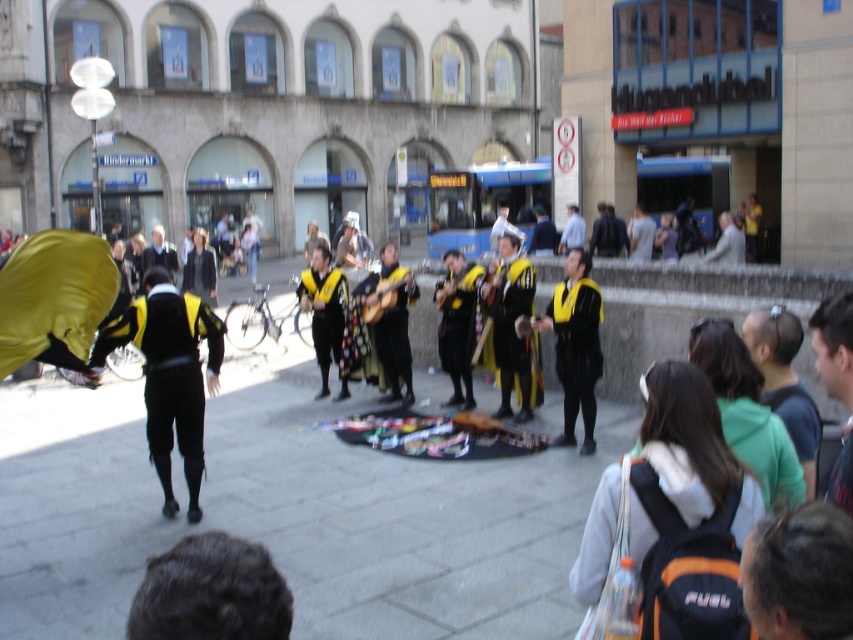
Question: Which point appears farthest from the camera in this image?

Choices:
 (A) (738, 252)
 (B) (167, 410)
 (C) (148, 262)
 (D) (792, 424)

Answer: (A)

Question: Is dark blue hoodie at lower right positioned in front of black velvet jacket at center?

Choices:
 (A) yes
 (B) no

Answer: (A)

Question: Which point appears farthest from the camera in this image?

Choices:
 (A) (511, 333)
 (B) (144, 252)

Answer: (B)

Question: Where is black leather jacket at center located in relation to light blue shirt at center in the image?

Choices:
 (A) above
 (B) below

Answer: (B)

Question: Is black velvet jacket at center in front of light gray fabric jacket at center?

Choices:
 (A) yes
 (B) no

Answer: (A)

Question: Based on their relative distances, which object is farther from the dark blue hoodie at lower right?

Choices:
 (A) black leather jacket at center
 (B) light gray fabric jacket at center
 (C) light blue shirt at center
 (D) black velvet pants at left

Answer: (C)